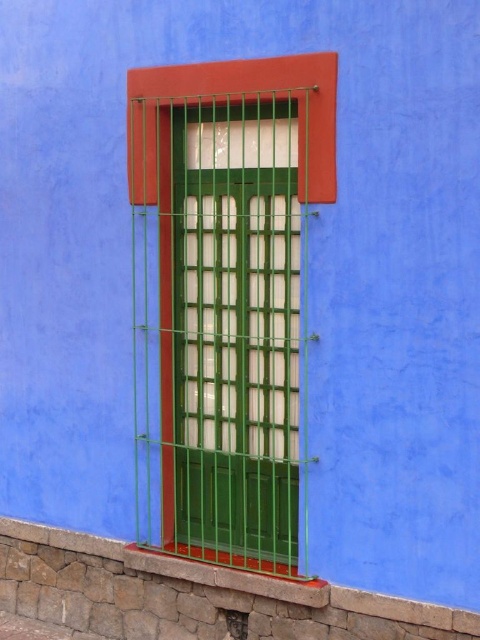
You are standing in front of the colorful wall with the rectangular window. There are two points marked on the wall, one at coordinates point (292, 230) and the other at point (100, 548). Which of these points is nearer to your current position?

Point (292, 230) is closer to the camera than point (100, 548), so the point at coordinates point (292, 230) is nearer to your current position.

You are a painter who wants to paint the green metallic shutter at center and the stone at lower left. Which object requires more vertical space for painting due to its height?

The green metallic shutter at center requires more vertical space for painting because it is much taller than the stone at lower left.